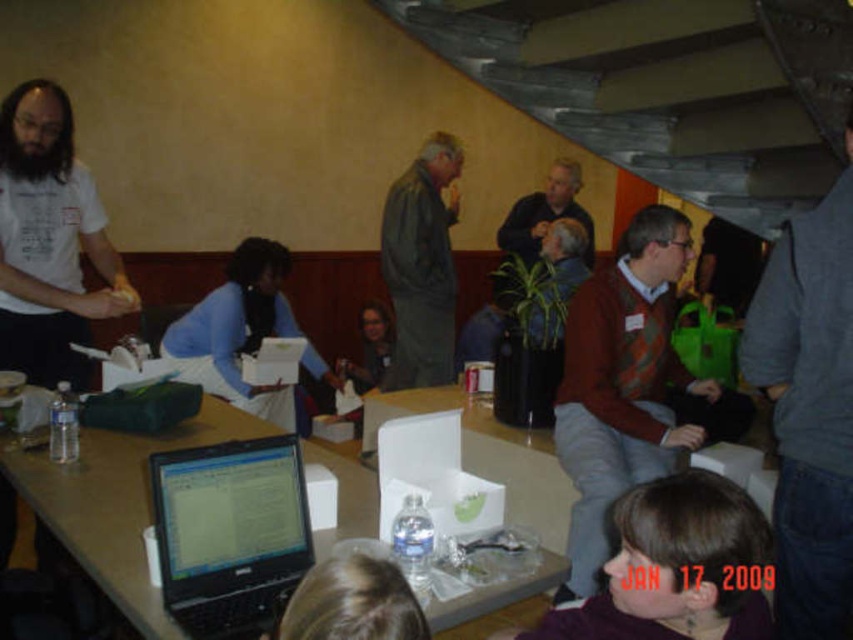
This screenshot has height=640, width=853. I want to click on purple matte shirt at lower center, so click(677, 566).

Does purple matte shirt at lower center appear over dark gray jacket at center?

Incorrect, purple matte shirt at lower center is not positioned above dark gray jacket at center.

Locate an element on the screen. purple matte shirt at lower center is located at coordinates (677, 566).

Who is more forward, [726,600] or [238,308]?

Positioned in front is point [726,600].

Who is positioned more to the left, purple matte shirt at lower center or blue matte shirt at center?

blue matte shirt at center

Between point (630, 532) and point (202, 353), which one is positioned in front?

Point (630, 532)

Where is `purple matte shirt at lower center`? This screenshot has height=640, width=853. purple matte shirt at lower center is located at coordinates (677, 566).

Who is taller, knitted sweater at center or white matte shirt at left?

Standing taller between the two is knitted sweater at center.

Does knitted sweater at center have a larger size compared to white matte shirt at left?

Indeed, knitted sweater at center has a larger size compared to white matte shirt at left.

Measure the distance between point (593, 419) and camera.

They are 2.82 meters apart.

Identify the location of knitted sweater at center. (630, 387).